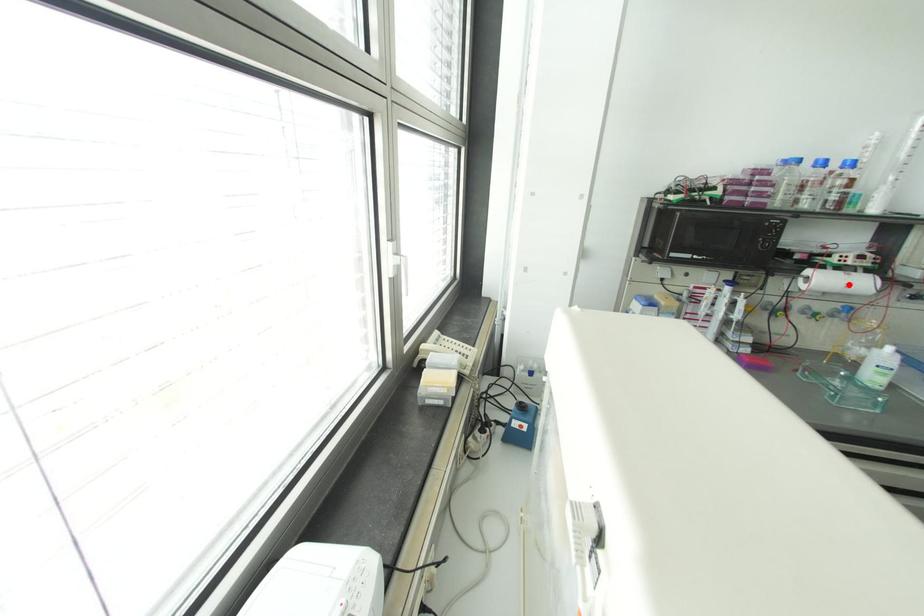
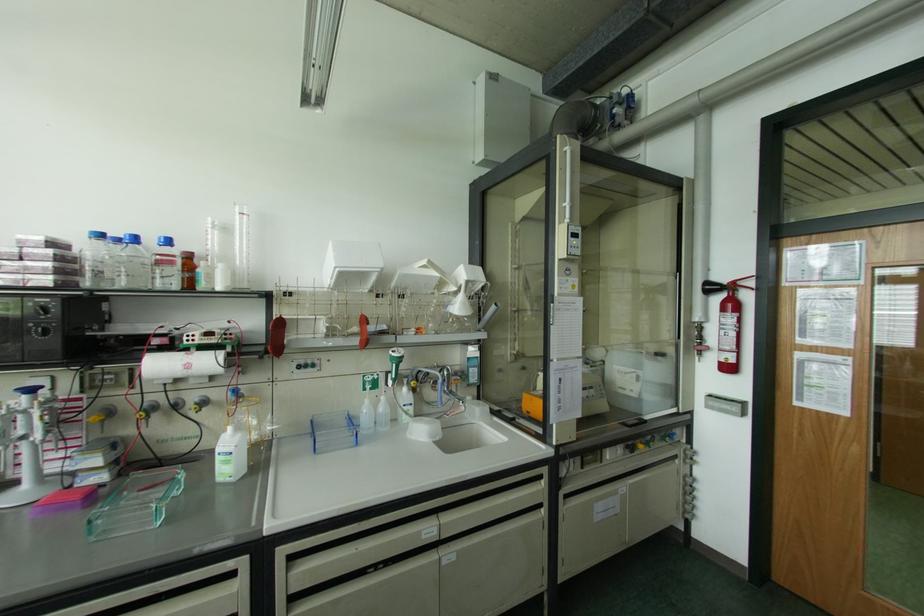
Locate, in the second image, the point that corresponds to the highlighted location in the first image.

(188, 366)